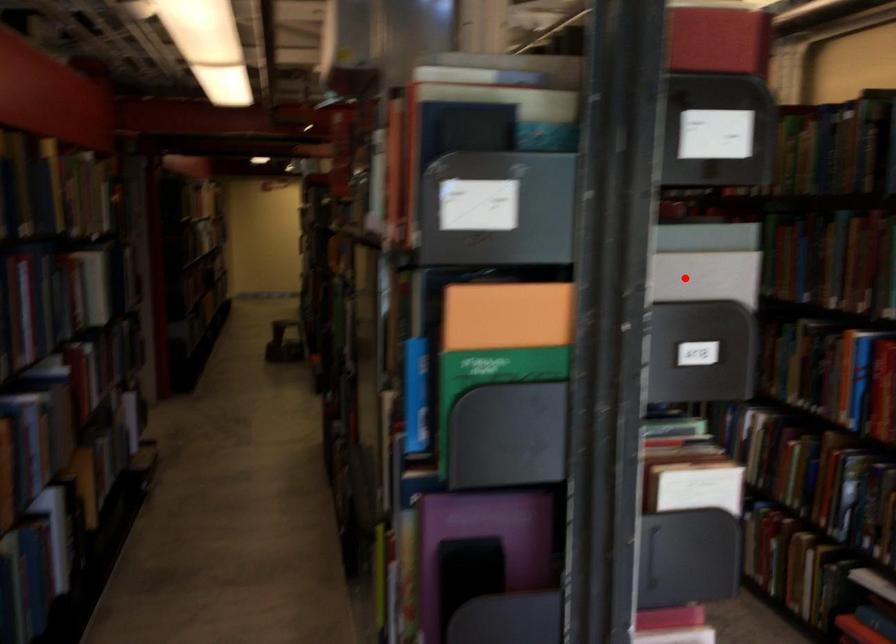
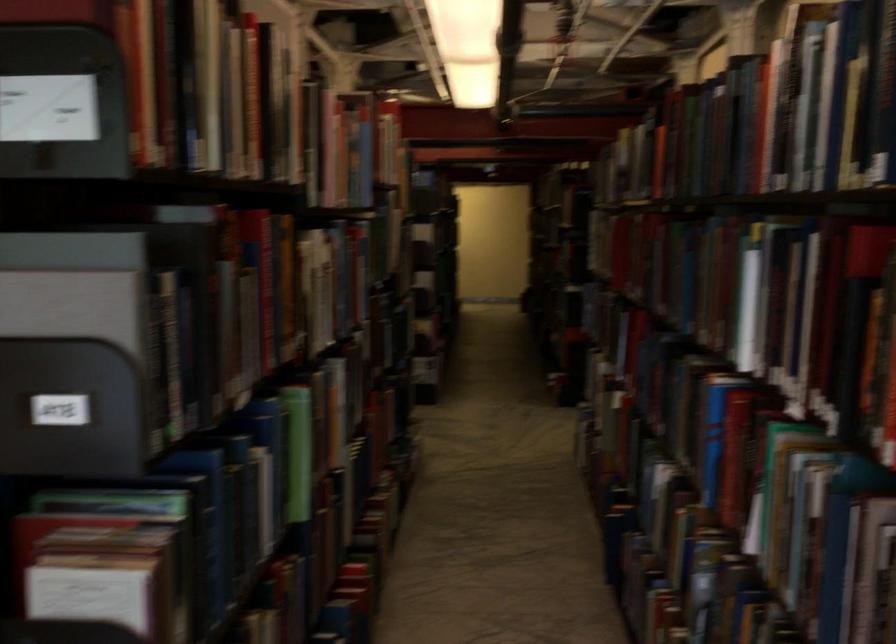
Question: I am providing you with two images of the same scene from different viewpoints. Image1 has a red point marked. In image2, the corresponding 3D location appears at what relative position? Reply with the corresponding letter.

Choices:
 (A) Closer
 (B) Farther

Answer: (A)